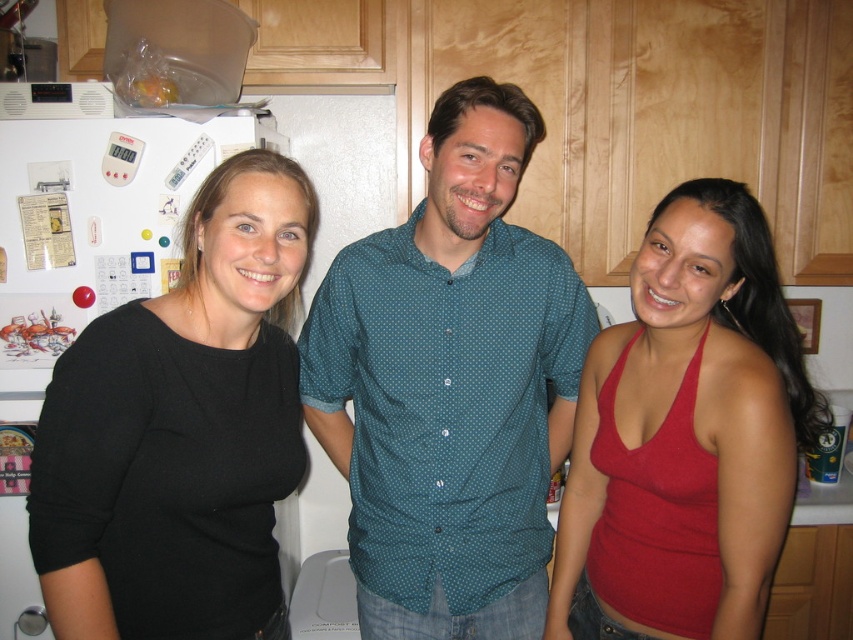
Question: Which object is positioned farthest from the black matte shirt at left?

Choices:
 (A) matte red tank top at center
 (B) teal dotted shirt at center

Answer: (A)

Question: Does black matte shirt at left lie in front of matte red tank top at center?

Choices:
 (A) yes
 (B) no

Answer: (A)

Question: Which of the following is the farthest from the observer?

Choices:
 (A) black matte shirt at left
 (B) matte red tank top at center
 (C) teal dotted shirt at center

Answer: (C)

Question: Which object is farther from the camera taking this photo?

Choices:
 (A) teal dotted shirt at center
 (B) matte red tank top at center
 (C) black matte shirt at left

Answer: (A)

Question: Does teal dotted shirt at center lie behind matte red tank top at center?

Choices:
 (A) no
 (B) yes

Answer: (B)

Question: Does black matte shirt at left appear on the right side of matte red tank top at center?

Choices:
 (A) no
 (B) yes

Answer: (A)